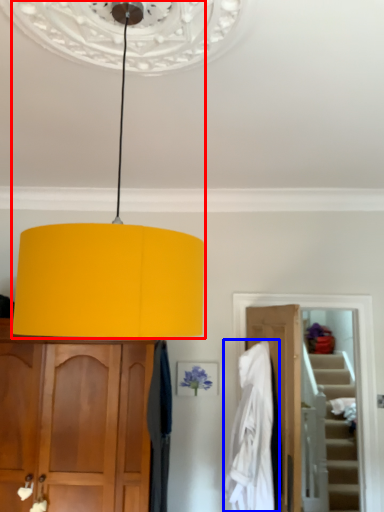
Question: Which of the following is the farthest to the observer, lamp (highlighted by a red box) or clothing (highlighted by a blue box)?

Choices:
 (A) lamp
 (B) clothing

Answer: (B)